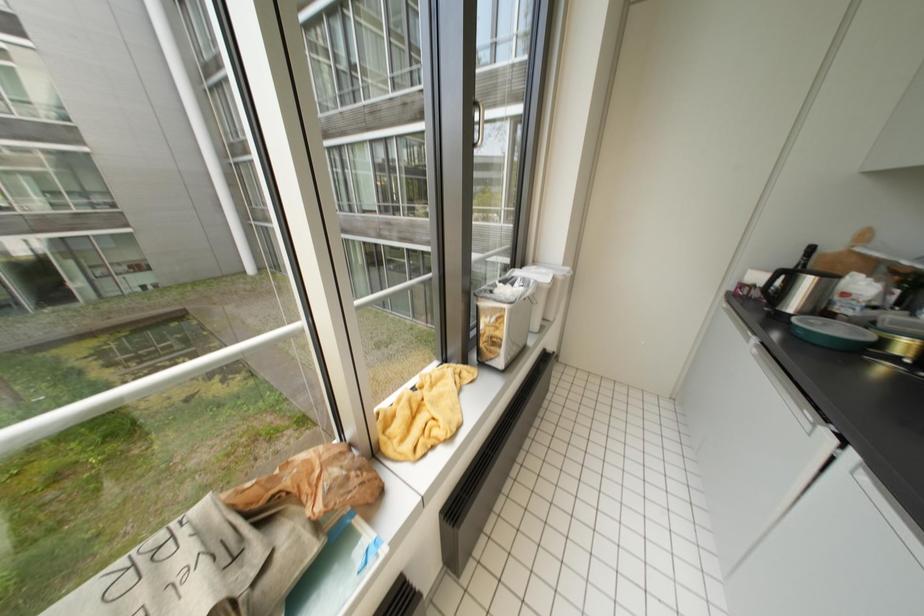
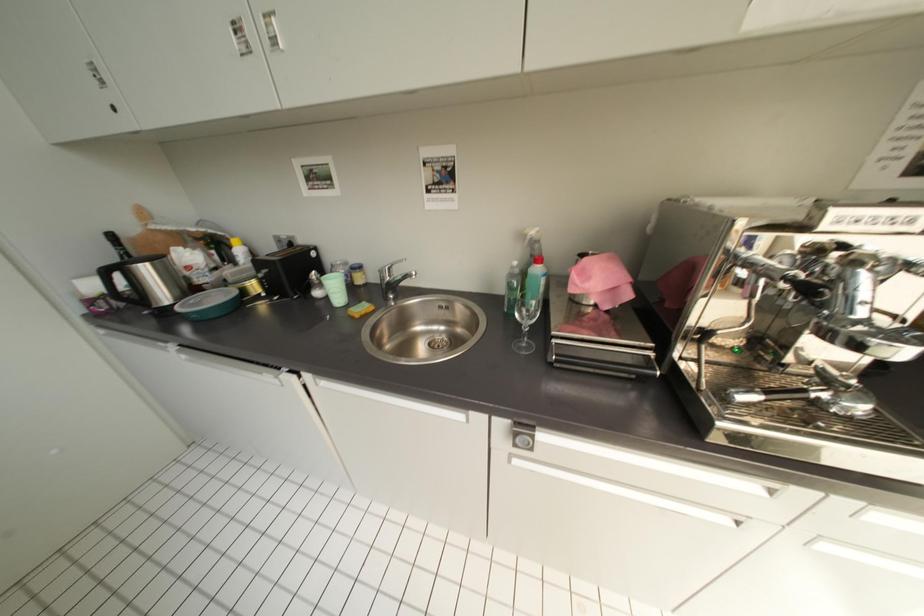
How did the camera likely rotate?

The rotation direction of the camera is right-down.